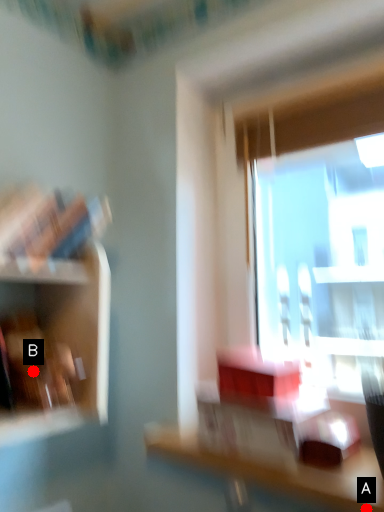
Question: Two points are circled on the image, labeled by A and B beside each circle. Among these points, which one is nearest to the camera?

Choices:
 (A) A is closer
 (B) B is closer

Answer: (A)